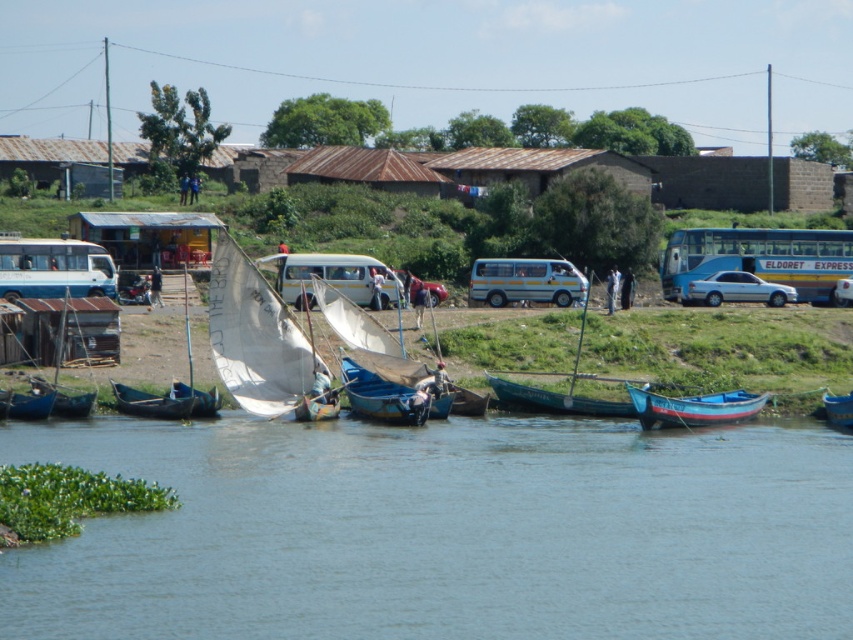
Is blue wooden boats at lower center bigger than wooden boat at lower left?

Correct, blue wooden boats at lower center is larger in size than wooden boat at lower left.

This screenshot has height=640, width=853. What do you see at coordinates (445, 531) in the screenshot? I see `blue wooden boats at lower center` at bounding box center [445, 531].

Describe the element at coordinates (445, 531) in the screenshot. I see `blue wooden boats at lower center` at that location.

You are a GUI agent. You are given a task and a screenshot of the screen. Output one action in this format:
    pyautogui.click(x=<x>, y=<y>)
    Task: Click on the blue wooden boats at lower center
    This screenshot has width=853, height=640.
    Given the screenshot: What is the action you would take?
    pyautogui.click(x=445, y=531)

Does white canvas sail at center have a greater height compared to wooden boat at lower left?

Correct, white canvas sail at center is much taller as wooden boat at lower left.

Which of these two, white canvas sail at center or wooden boat at lower left, stands taller?

white canvas sail at center is taller.

This screenshot has height=640, width=853. Identify the location of white canvas sail at center. (254, 337).

Is white canvas sail at center shorter than silver metallic sedan at center?

Incorrect, white canvas sail at center's height does not fall short of silver metallic sedan at center's.

Does point (221, 316) come farther from viewer compared to point (837, 300)?

No, (221, 316) is closer to viewer.

The height and width of the screenshot is (640, 853). I want to click on white canvas sail at center, so click(x=254, y=337).